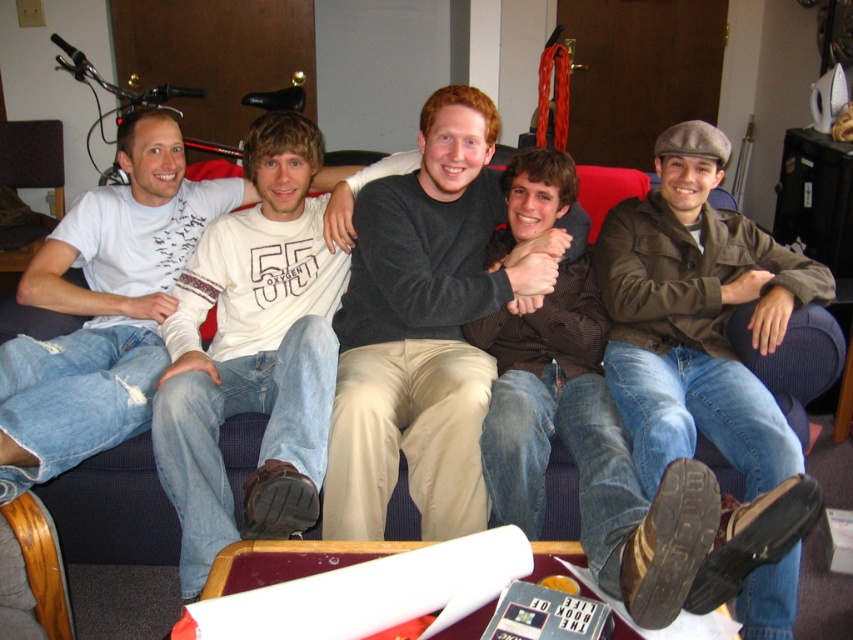
Which is more to the left, brown textured shirt at center or denim jeans at left?

From the viewer's perspective, denim jeans at left appears more on the left side.

Which of these two, brown textured shirt at center or denim jeans at left, stands shorter?

denim jeans at left is shorter.

At what (x,y) coordinates should I click in order to perform the action: click on brown textured shirt at center. Please return your answer as a coordinate pair (x, y). This screenshot has height=640, width=853. Looking at the image, I should click on (587, 452).

Locate an element on the screen. This screenshot has width=853, height=640. brown textured shirt at center is located at coordinates (587, 452).

Can you confirm if dark gray sweater at center is thinner than brown textured shirt at center?

Incorrect, dark gray sweater at center's width is not less than brown textured shirt at center's.

Who is more distant from viewer, (x=360, y=280) or (x=503, y=442)?

Point (x=360, y=280)

The width and height of the screenshot is (853, 640). I want to click on dark gray sweater at center, so click(x=426, y=326).

Which of these two, dark gray sweater at center or brown leather jacket at right, stands shorter?

dark gray sweater at center

Is point (430, 164) positioned behind point (672, 144)?

No.

Is point (466, 253) positioned in front of point (666, 362)?

That is False.

This screenshot has width=853, height=640. Identify the location of dark gray sweater at center. (426, 326).